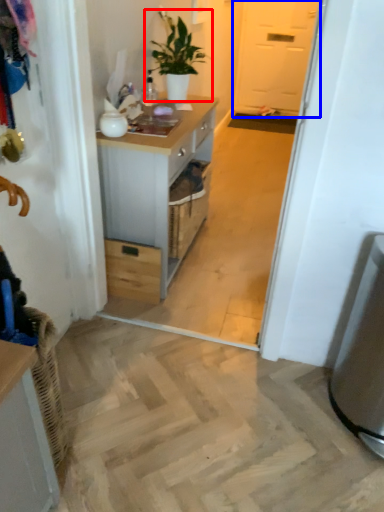
Question: Which of the following is the farthest to the observer, houseplant (highlighted by a red box) or screen door (highlighted by a blue box)?

Choices:
 (A) houseplant
 (B) screen door

Answer: (B)